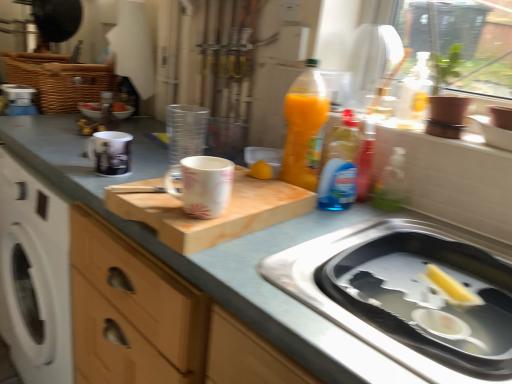
You are a GUI agent. You are given a task and a screenshot of the screen. Output one action in this format:
    pyautogui.click(x=<x>, y=<y>)
    Task: Click on the free space that is to the left of matte white mug at upper left, the second mug positioned from the right
    The width and height of the screenshot is (512, 384).
    Given the screenshot: What is the action you would take?
    pyautogui.click(x=71, y=154)